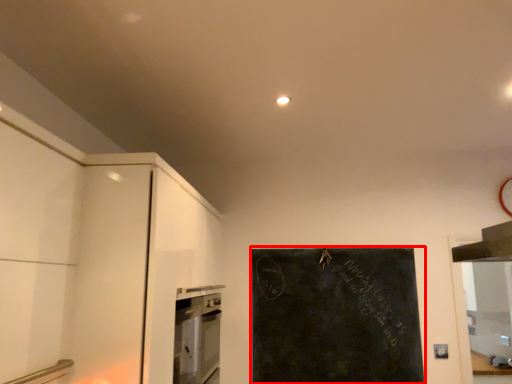
Question: From the image's perspective, where is bulletin board (annotated by the red box) located relative to home appliance?

Choices:
 (A) below
 (B) above

Answer: (B)